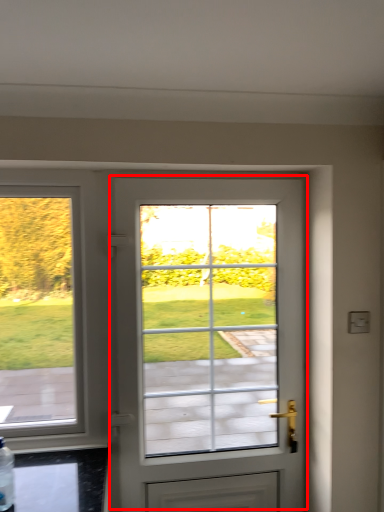
Question: In this image, where is door (annotated by the red box) located relative to bottle?

Choices:
 (A) right
 (B) left

Answer: (A)